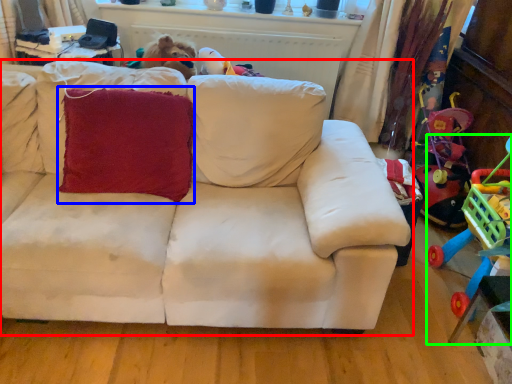
Question: Which object is positioned closest to studio couch (highlighted by a red box)? Select from throw pillow (highlighted by a blue box) and toy (highlighted by a green box).

Choices:
 (A) throw pillow
 (B) toy

Answer: (A)